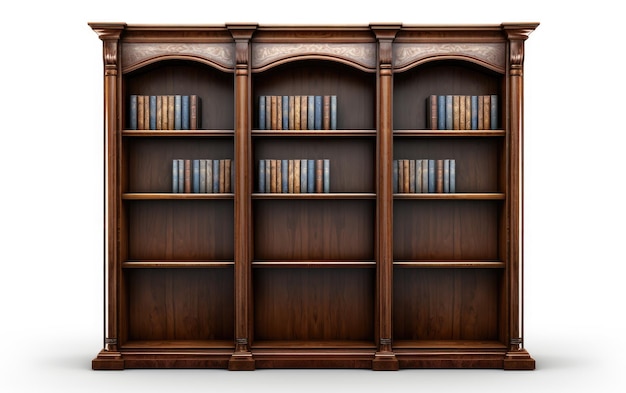
Find the location of `books on top left shelf`. books on top left shelf is located at coordinates (131, 119), (139, 119), (145, 119), (151, 120), (158, 121), (162, 121), (167, 121), (173, 121), (181, 120), (193, 118).